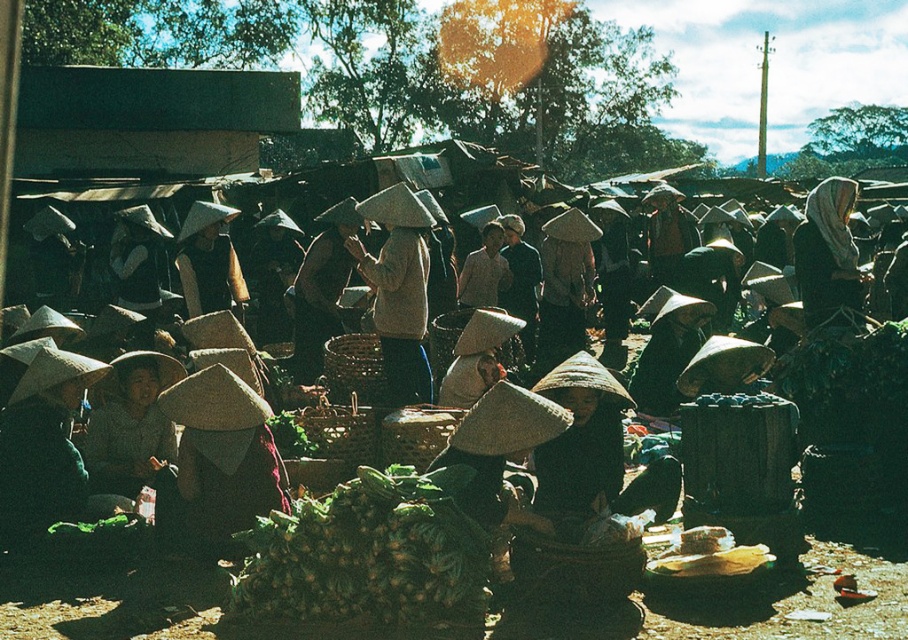
You are standing at the position of point (349, 248) and want to walk towards the entrance of the market. There is a point at (363, 513) in your path. Is this point in front of or behind you relative to your direction of movement?

The point at (363, 513) is in front of point (349, 248), so it is in front of you as you walk towards the entrance.

You are a customer at the market and want to buy a hat. You see a matte beige hat at center and a light beige fabric headscarf at center. Which item is located to the left of the other?

The matte beige hat at center is positioned on the left side of light beige fabric headscarf at center.